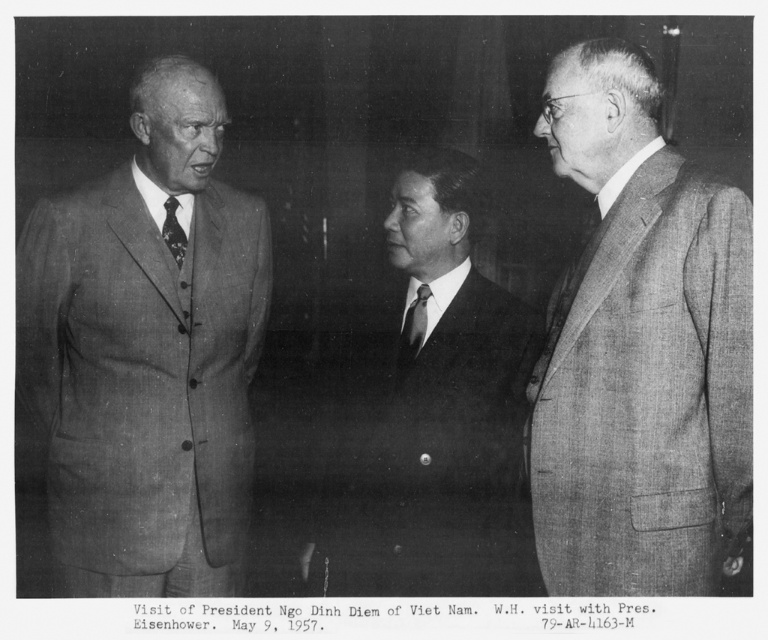
Question: Which point appears farthest from the camera in this image?

Choices:
 (A) (439, 243)
 (B) (179, 349)
 (C) (174, 218)

Answer: (A)

Question: Is matte gray suit at left smaller than smooth black suit at center?

Choices:
 (A) no
 (B) yes

Answer: (B)

Question: Can you confirm if matte gray suit at left is wider than dark blue silk tie at left?

Choices:
 (A) yes
 (B) no

Answer: (A)

Question: Which is nearer to the dark blue silk tie at left?

Choices:
 (A) gray textured suit at right
 (B) silky black tie at center
 (C) matte gray suit at left
 (D) smooth black suit at center

Answer: (C)

Question: Which is nearer to the gray textured suit at right?

Choices:
 (A) dark blue silk tie at left
 (B) matte gray suit at left

Answer: (B)

Question: Is gray textured suit at right thinner than smooth black suit at center?

Choices:
 (A) no
 (B) yes

Answer: (B)